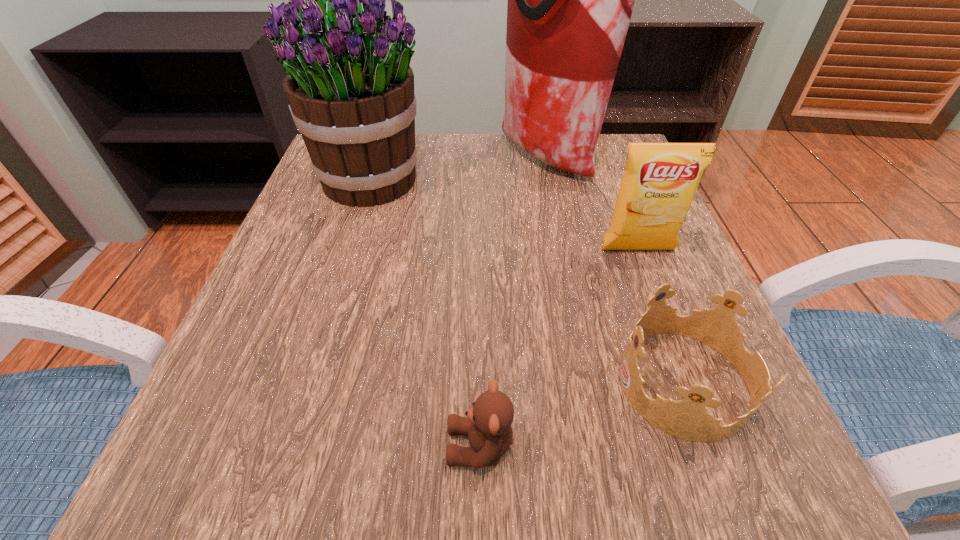
I want to click on free location located 0.050m on the front-facing side of the tiara, so click(x=585, y=382).

The image size is (960, 540). I want to click on vacant space situated on the front-facing side of the tiara, so click(x=549, y=382).

You are a GUI agent. You are given a task and a screenshot of the screen. Output one action in this format:
    pyautogui.click(x=<x>, y=<y>)
    Task: Click on the free region located 0.210m on the front-facing side of the tiara
    
    Given the screenshot: What is the action you would take?
    pyautogui.click(x=470, y=382)

I want to click on free space located 0.300m on the face of the fourth object from right to left, so click(x=207, y=447).

Image resolution: width=960 pixels, height=540 pixels. What are the coordinates of `vacant region located 0.270m on the face of the fourth object from right to left` in the screenshot? It's located at (231, 447).

Locate an element on the screen. Image resolution: width=960 pixels, height=540 pixels. free space located 0.150m on the face of the fourth object from right to left is located at coordinates (327, 447).

Identify the location of grocery bag that is at the far edge. (570, 0).

At what (x,y) coordinates should I click in order to perform the action: click on bouquet positioned at the far edge. Please return your answer as a coordinate pair (x, y). Image resolution: width=960 pixels, height=540 pixels. Looking at the image, I should click on (350, 89).

Find the location of `tiara present at the near edge`. tiara present at the near edge is located at coordinates (687, 419).

Where is `teddy bear that is at the near edge`? teddy bear that is at the near edge is located at coordinates (488, 423).